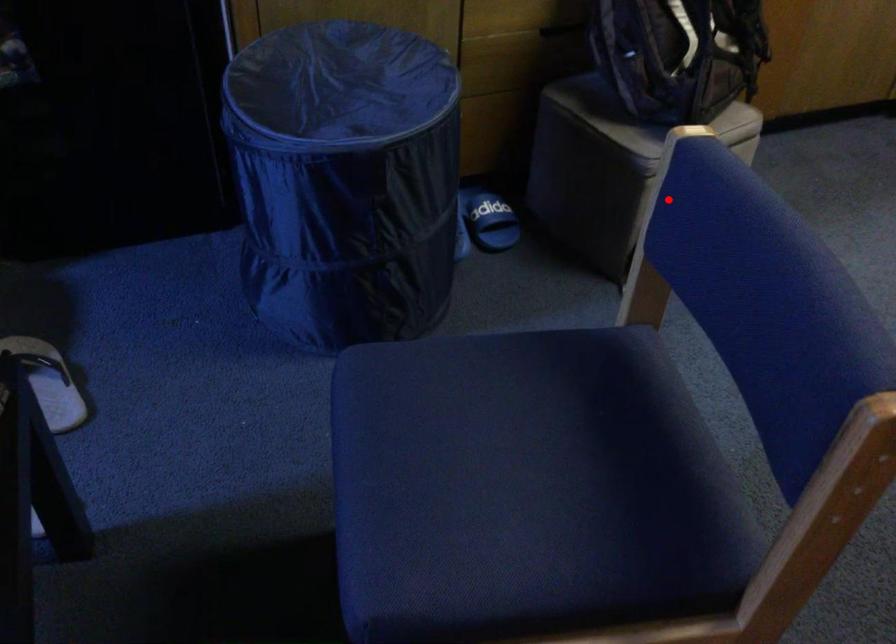
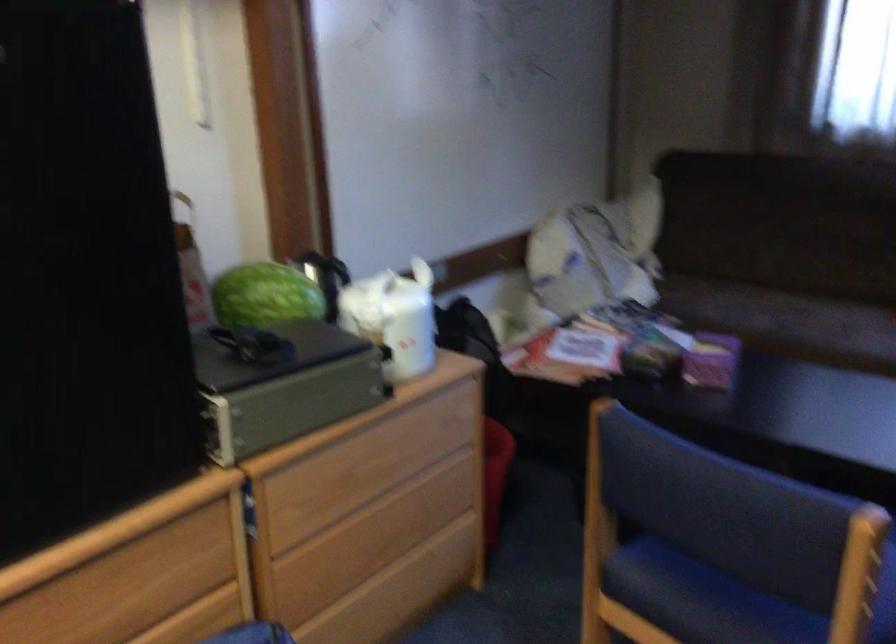
Question: I am providing you with two images of the same scene from different viewpoints. In image1, a red point is highlighted. Considering the same 3D point in image2, which of the following is correct?

Choices:
 (A) It is closer
 (B) It is farther

Answer: (B)